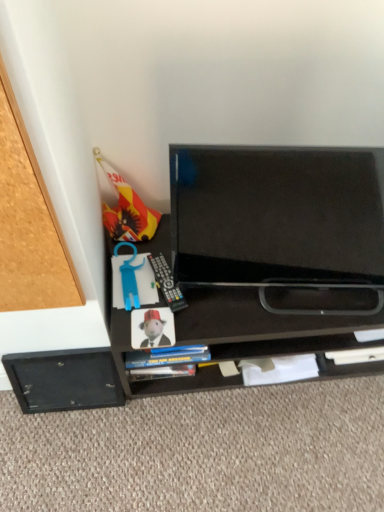
This screenshot has height=512, width=384. What do you see at coordinates (261, 325) in the screenshot?
I see `black matte tv at center` at bounding box center [261, 325].

Describe the element at coordinates (64, 380) in the screenshot. The height and width of the screenshot is (512, 384). I see `black matte drawer at lower left` at that location.

Locate an element on the screen. The width and height of the screenshot is (384, 512). black matte tv at center is located at coordinates (261, 325).

Does matte paper book at center have a lesser width compared to black plastic remote at lower center?

Indeed, matte paper book at center has a lesser width compared to black plastic remote at lower center.

Considering the relative sizes of matte paper book at center and black plastic remote at lower center in the image provided, is matte paper book at center smaller than black plastic remote at lower center?

Yes, matte paper book at center is smaller than black plastic remote at lower center.

From a real-world perspective, does matte paper book at center sit lower than black plastic remote at lower center?

Yes, from a real-world perspective, matte paper book at center is below black plastic remote at lower center.

Is matte paper book at center turned away from black plastic remote at lower center?

No, matte paper book at center is not facing the opposite direction of black plastic remote at lower center.

Based on the photo, between black matte drawer at lower left and black glossy tv at center, which one has smaller size?

black matte drawer at lower left is smaller.

From a real-world perspective, between black matte drawer at lower left and black glossy tv at center, who is vertically lower?

black matte drawer at lower left is physically lower.

From the image's perspective, is black matte drawer at lower left on black glossy tv at center?

Incorrect, from the image's perspective, black matte drawer at lower left is lower than black glossy tv at center.

Which is more to the right, matte paper book at center or black matte tv at center?

black matte tv at center.

In the scene shown: Is matte paper book at center not within black matte tv at center?

No, matte paper book at center is not entirely external to black matte tv at center.

Is point (155, 308) closer or farther from the camera than point (341, 316)?

Clearly, point (155, 308) is closer to the camera than point (341, 316).

Based on their sizes in the image, would you say matte paper book at center is bigger or smaller than black matte tv at center?

matte paper book at center is smaller than black matte tv at center.

Between black glossy tv at center and black matte tv at center, which one has larger size?

Bigger between the two is black matte tv at center.

From a real-world perspective, which object stands above the other?

black glossy tv at center is physically above.

Are black glossy tv at center and black matte tv at center located far from each other?

That's not correct — black glossy tv at center is a little close to black matte tv at center.

Which of these two, black plastic remote at lower center or black glossy tv at center, stands taller?

Standing taller between the two is black glossy tv at center.

Does black plastic remote at lower center have a lesser width compared to black glossy tv at center?

Incorrect, the width of black plastic remote at lower center is not less than that of black glossy tv at center.

Are black plastic remote at lower center and black glossy tv at center located far from each other?

black plastic remote at lower center is actually quite close to black glossy tv at center.

Can you confirm if black plastic remote at lower center is bigger than black glossy tv at center?

Actually, black plastic remote at lower center might be smaller than black glossy tv at center.

From the image's perspective, is matte paper book at center located above or below black glossy tv at center?

Clearly, from the image's perspective, matte paper book at center is below black glossy tv at center.

Between point (173, 332) and point (176, 147), which one is positioned behind?

The point (176, 147) is more distant.

The width and height of the screenshot is (384, 512). What are the coordinates of `paperback book directly beneath the black glossy tv at center (from a real-world perspective)` in the screenshot? It's located at (152, 328).

Considering the relative sizes of matte paper book at center and black glossy tv at center in the image provided, is matte paper book at center smaller than black glossy tv at center?

Correct, matte paper book at center occupies less space than black glossy tv at center.

Which is less distant, (235, 338) or (158, 344)?

Point (235, 338) is farther from the camera than point (158, 344).

Consider the image. Considering the positions of objects black matte tv at center and matte paper book at center in the image provided, who is more to the left, black matte tv at center or matte paper book at center?

matte paper book at center.

Measure the distance between black matte tv at center and matte paper book at center.

black matte tv at center and matte paper book at center are 8.56 inches apart.

In the image, is black matte tv at center positioned in front of or behind matte paper book at center?

In the image, black matte tv at center appears in front of matte paper book at center.

This screenshot has height=512, width=384. What are the coordinates of `paperback book that appears in front of the black plastic remote at lower center` in the screenshot? It's located at (152, 328).

Image resolution: width=384 pixels, height=512 pixels. In order to click on back above the black matte drawer at lower left (from a real-world perspective) in this screenshot , I will do `click(277, 215)`.

Based on their spatial positions, is black matte tv at center or black matte drawer at lower left further from matte paper book at center?

Based on the image, black matte drawer at lower left appears to be further to matte paper book at center.

When comparing their distances from black glossy tv at center, does black matte drawer at lower left or matte paper book at center seem closer?

Based on the image, matte paper book at center appears to be nearer to black glossy tv at center.

Estimate the real-world distances between objects in this image. Which object is closer to black matte tv at center, matte paper book at center or black matte drawer at lower left?

Based on the image, matte paper book at center appears to be nearer to black matte tv at center.

Estimate the real-world distances between objects in this image. Which object is further from black matte tv at center, black matte drawer at lower left or matte paper book at center?

black matte drawer at lower left is further to black matte tv at center.

Estimate the real-world distances between objects in this image. Which object is closer to black plastic remote at lower center, black matte tv at center or black glossy tv at center?

Among the two, black matte tv at center is located nearer to black plastic remote at lower center.

From the image, which object appears to be farther from matte paper book at center, black plastic remote at lower center or black matte drawer at lower left?

black matte drawer at lower left is further to matte paper book at center.

Considering their positions, is black plastic remote at lower center positioned further to black matte drawer at lower left than black glossy tv at center?

black glossy tv at center is positioned further to the anchor black matte drawer at lower left.

Looking at the image, which one is located further to black plastic remote at lower center, matte paper book at center or black glossy tv at center?

Based on the image, black glossy tv at center appears to be further to black plastic remote at lower center.

Find the location of a particular element. The width and height of the screenshot is (384, 512). equipment between black matte drawer at lower left and black matte tv at center from left to right is located at coordinates (167, 283).

At what (x,y) coordinates should I click in order to perform the action: click on paperback book between black glossy tv at center and black plastic remote at lower center from front to back. Please return your answer as a coordinate pair (x, y). The image size is (384, 512). Looking at the image, I should click on (152, 328).

At what (x,y) coordinates should I click in order to perform the action: click on desk between black glossy tv at center and black plastic remote at lower center along the z-axis. Please return your answer as a coordinate pair (x, y). Looking at the image, I should click on (261, 325).

Where is `equipment situated between matte paper book at center and black matte tv at center from left to right`? The image size is (384, 512). equipment situated between matte paper book at center and black matte tv at center from left to right is located at coordinates (167, 283).